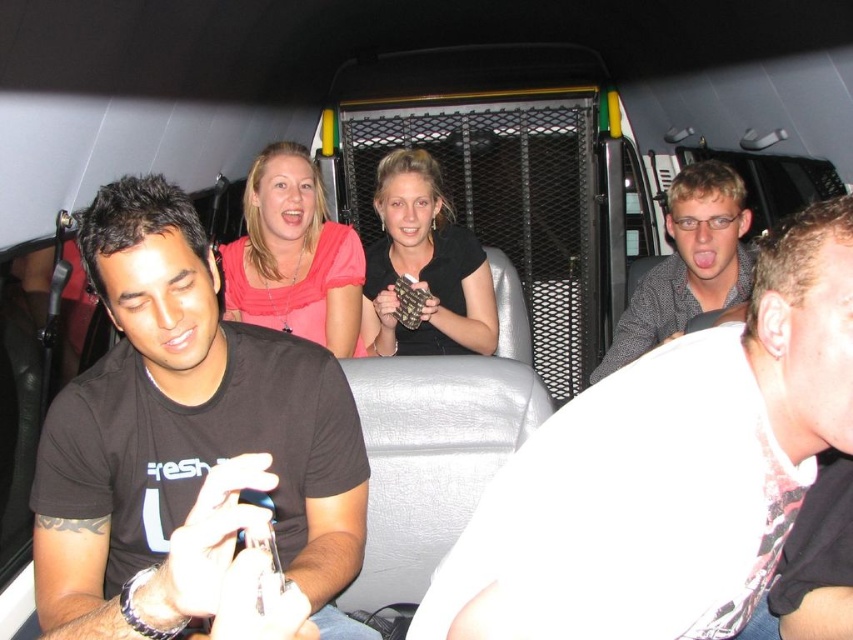
Question: Is the position of matte black shirt at center more distant than that of matte pink shirt at upper center?

Choices:
 (A) yes
 (B) no

Answer: (B)

Question: Which of the following is the closest to the observer?

Choices:
 (A) matte black shirt at center
 (B) black matte t-shirt at left
 (C) checkered fabric shirt at right
 (D) matte pink shirt at upper center

Answer: (B)

Question: Considering the relative positions of matte black shirt at center and matte pink shirt at upper center in the image provided, where is matte black shirt at center located with respect to matte pink shirt at upper center?

Choices:
 (A) below
 (B) above

Answer: (A)

Question: Based on their relative distances, which object is farther from the black matte t-shirt at left?

Choices:
 (A) checkered fabric shirt at right
 (B) matte pink shirt at upper center
 (C) black matte necklace at center
 (D) matte black shirt at center

Answer: (A)

Question: Which of these objects is positioned closest to the black matte necklace at center?

Choices:
 (A) matte pink shirt at upper center
 (B) matte black shirt at center
 (C) black matte t-shirt at left

Answer: (A)

Question: Is black matte t-shirt at left to the left of matte pink shirt at upper center from the viewer's perspective?

Choices:
 (A) yes
 (B) no

Answer: (B)